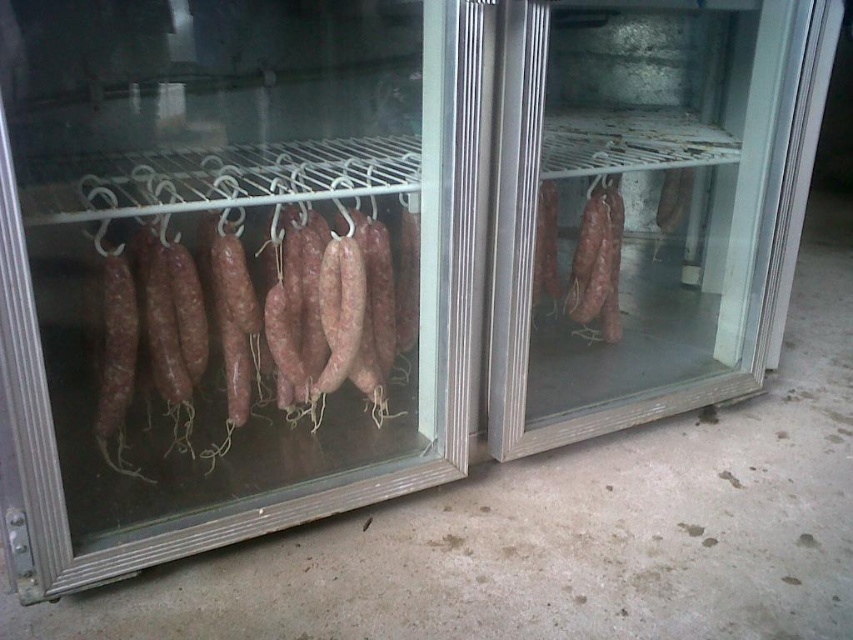
Who is more forward, (93, 387) or (158, 353)?

Point (158, 353) is more forward.

Measure the distance between transparent glass door at left and camera.

transparent glass door at left is 33.52 inches away from camera.

At what (x,y) coordinates should I click in order to perform the action: click on transparent glass door at left. Please return your answer as a coordinate pair (x, y). The height and width of the screenshot is (640, 853). Looking at the image, I should click on (227, 269).

Is transparent glass door at center smaller than brown matte sausages at left?

No.

Based on the photo, does transparent glass door at center appear on the right side of brown matte sausages at left?

Correct, you'll find transparent glass door at center to the right of brown matte sausages at left.

This screenshot has width=853, height=640. Identify the location of transparent glass door at center. (650, 202).

Find the location of `transparent glass door at center`. transparent glass door at center is located at coordinates (650, 202).

Is transparent glass door at left in front of transparent glass door at center?

Yes, it is.

Can you confirm if transparent glass door at left is shorter than transparent glass door at center?

In fact, transparent glass door at left may be taller than transparent glass door at center.

Between point (317, 246) and point (705, 232), which one is positioned behind?

Positioned behind is point (705, 232).

At what (x,y) coordinates should I click in order to perform the action: click on transparent glass door at left. Please return your answer as a coordinate pair (x, y). This screenshot has width=853, height=640. Looking at the image, I should click on (227, 269).